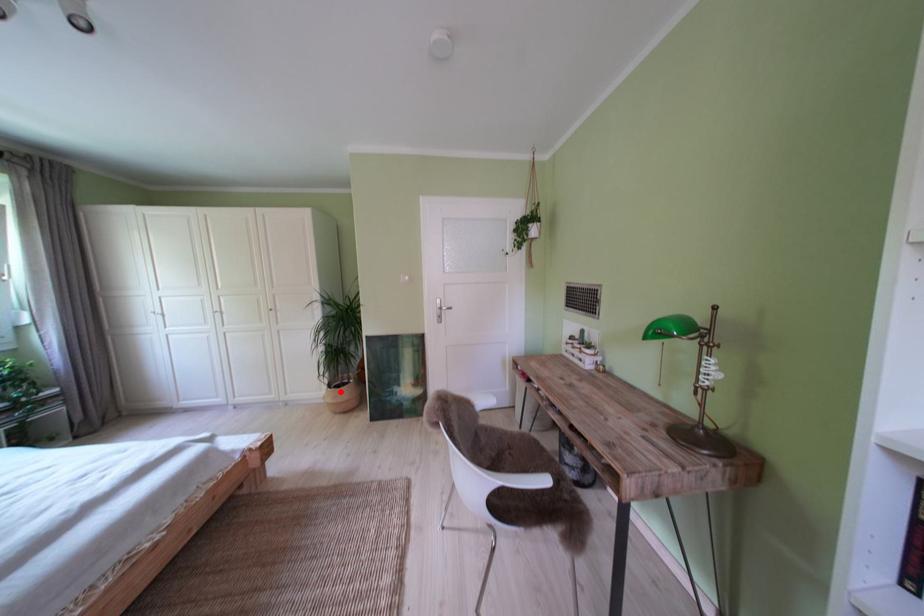
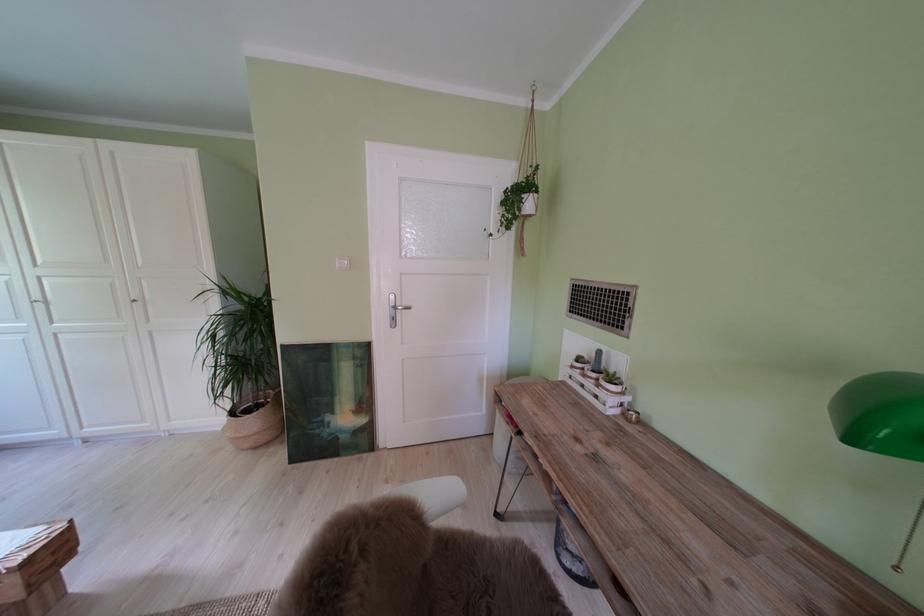
The point at the highlighted location is marked in the first image. Where is the corresponding point in the second image?

(242, 418)